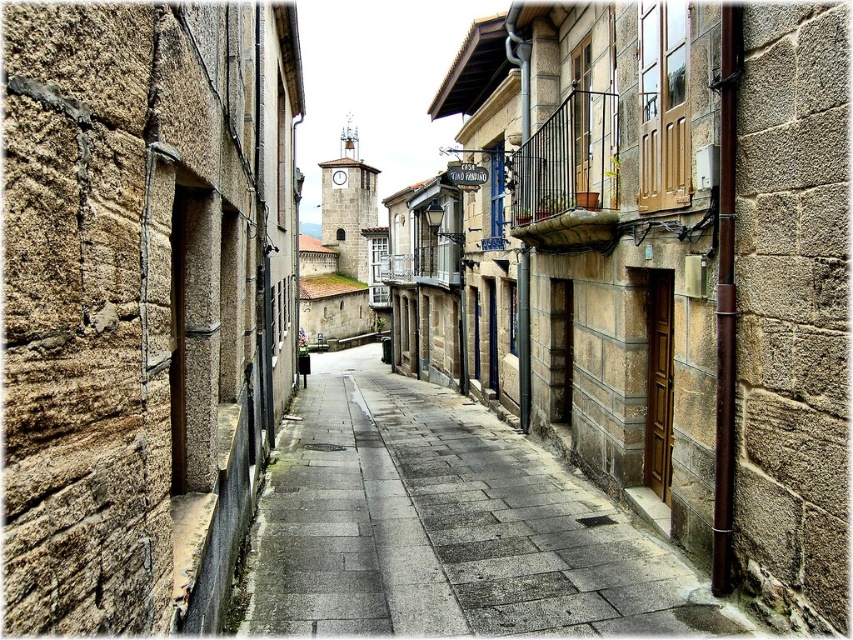
You are standing in the middle of the narrow street and want to touch the rough stone wall at left. In which direction should you move to reach it?

You should move to your left to reach the rough stone wall at left since it is located at the left side of the street.

You are standing on the gray stone pavement at center and want to walk to the right side of the street. Which direction should you turn to move away from the rough stone wall at left?

You should turn to your right to move away from the rough stone wall at left, as it is positioned to the left of the gray stone pavement at center.

You are a delivery person carrying a package that is 10 feet long. You need to navigate through the narrow street between the rough stone wall at left and the gray stone pavement at center. Can you pass through this space with your package without bending it?

The rough stone wall at left and gray stone pavement at center are 11.05 feet apart, so yes, the delivery person can pass through the space with their 10 feet long package since the distance between them is wider than the package.